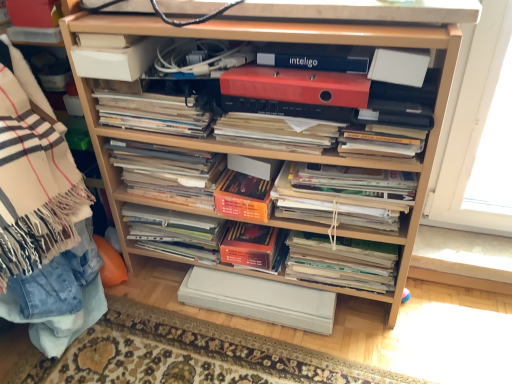
Question: From the image's perspective, is matte black magazine at center, positioned as the sixth magazine in bottom-to-top order, on top of white matte paper at upper right, the fourth paperback book from the top?

Choices:
 (A) yes
 (B) no

Answer: (B)

Question: Is matte black magazine at center, which is the second magazine from top to bottom, far from white matte paper at upper right, marked as the 4th paperback book in a bottom-to-top arrangement?

Choices:
 (A) yes
 (B) no

Answer: (B)

Question: Is the depth of matte black magazine at center, which is the second magazine from top to bottom, less than that of white matte paper at upper right, the fourth paperback book from the top?

Choices:
 (A) no
 (B) yes

Answer: (A)

Question: Is matte black magazine at center, which is the second magazine from top to bottom, at the right side of white matte paper at upper right, marked as the 4th paperback book in a bottom-to-top arrangement?

Choices:
 (A) yes
 (B) no

Answer: (B)

Question: Can you confirm if matte black magazine at center, which is the second magazine from top to bottom, is bigger than white matte paper at upper right, marked as the 4th paperback book in a bottom-to-top arrangement?

Choices:
 (A) no
 (B) yes

Answer: (B)

Question: Does point (222, 193) appear closer or farther from the camera than point (339, 69)?

Choices:
 (A) farther
 (B) closer

Answer: (A)

Question: Choose the correct answer: Is orange matte paperback book at center, arranged as the fifth paperback book when viewed from the top, inside blue matte inteligo at upper center, which appears as the sixth paperback book when ordered from the bottom, or outside it?

Choices:
 (A) outside
 (B) inside

Answer: (A)

Question: From a real-world perspective, is orange matte paperback book at center, placed as the 3th paperback book when sorted from bottom to top, physically located above or below blue matte inteligo at upper center, which appears as the second paperback book when viewed from the top?

Choices:
 (A) above
 (B) below

Answer: (B)

Question: In terms of height, does orange matte paperback book at center, arranged as the fifth paperback book when viewed from the top, look taller or shorter compared to blue matte inteligo at upper center, which appears as the second paperback book when viewed from the top?

Choices:
 (A) tall
 (B) short

Answer: (A)

Question: In terms of width, does white matte paper at upper left, the first paperback book in the top-to-bottom sequence, look wider or thinner when compared to orange matte paperback book at center, which is the 6th paperback book in top-to-bottom order?

Choices:
 (A) thin
 (B) wide

Answer: (A)

Question: From a real-world perspective, is white matte paper at upper left, the first paperback book in the top-to-bottom sequence, positioned above or below orange matte paperback book at center, which is the 2th paperback book from bottom to top?

Choices:
 (A) above
 (B) below

Answer: (A)

Question: Based on their positions, is white matte paper at upper left, the first paperback book in the top-to-bottom sequence, located to the left or right of orange matte paperback book at center, which is the 6th paperback book in top-to-bottom order?

Choices:
 (A) left
 (B) right

Answer: (A)

Question: Relative to orange matte paperback book at center, which is the 6th paperback book in top-to-bottom order, is white matte paper at upper left, the seventh paperback book positioned from the bottom, in front or behind?

Choices:
 (A) front
 (B) behind

Answer: (A)

Question: Does point (394, 66) appear closer or farther from the camera than point (221, 289)?

Choices:
 (A) closer
 (B) farther

Answer: (A)

Question: In terms of size, does white matte paper at upper right, marked as the 4th paperback book in a bottom-to-top arrangement, appear bigger or smaller than matte orange paperback book at center, which appears as the 1th paperback book when ordered from the bottom?

Choices:
 (A) small
 (B) big

Answer: (A)